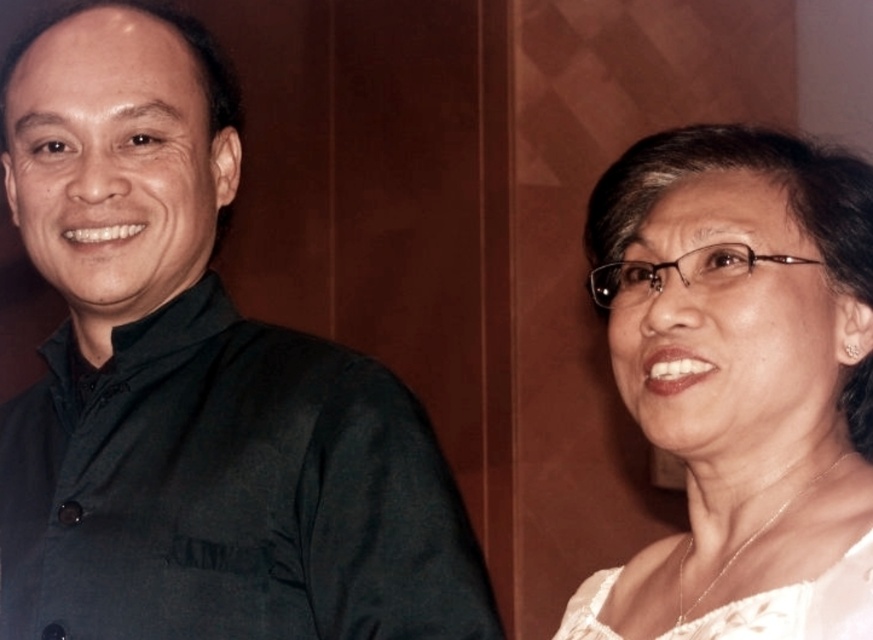
Question: Among these objects, which one is nearest to the camera?

Choices:
 (A) white lace blouse at upper right
 (B) white lace dress at right

Answer: (A)

Question: Is dark green shirt at left bigger than white lace blouse at upper right?

Choices:
 (A) no
 (B) yes

Answer: (B)

Question: Among these objects, which one is nearest to the camera?

Choices:
 (A) white lace blouse at upper right
 (B) dark green shirt at left
 (C) white lace dress at right

Answer: (A)

Question: Is dark green shirt at left thinner than white lace dress at right?

Choices:
 (A) yes
 (B) no

Answer: (B)

Question: Which point appears closest to the camera in this image?

Choices:
 (A) (686, 269)
 (B) (788, 586)

Answer: (B)

Question: Can you confirm if dark green shirt at left is positioned above white lace blouse at upper right?

Choices:
 (A) no
 (B) yes

Answer: (B)